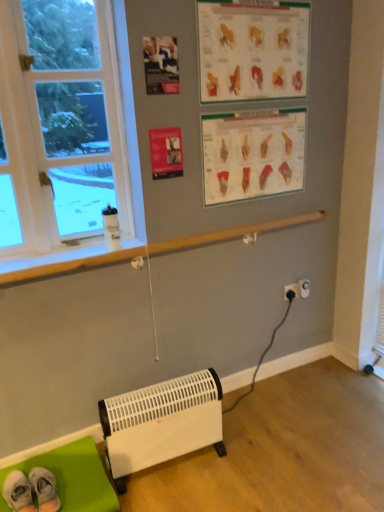
Where is `vacant space underneath white plastic heater at lower center (from a real-world perspective)`? The height and width of the screenshot is (512, 384). vacant space underneath white plastic heater at lower center (from a real-world perspective) is located at coordinates (172, 468).